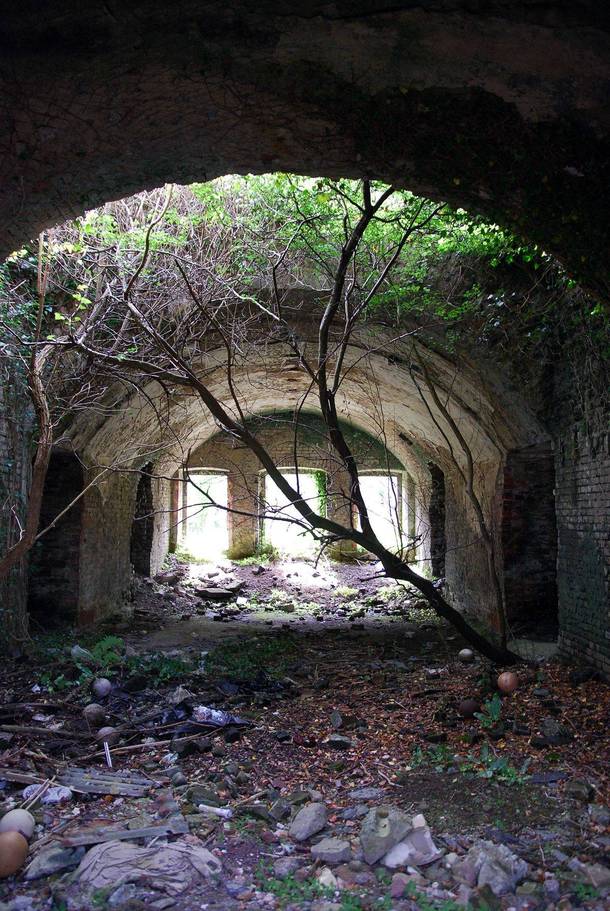
At what (x,y) coordinates should I click in order to perform the action: click on left and right doorway. Please return your answer as a coordinate pair (x, y). This screenshot has width=610, height=911. Looking at the image, I should click on (57, 547), (138, 537), (434, 535), (510, 549).